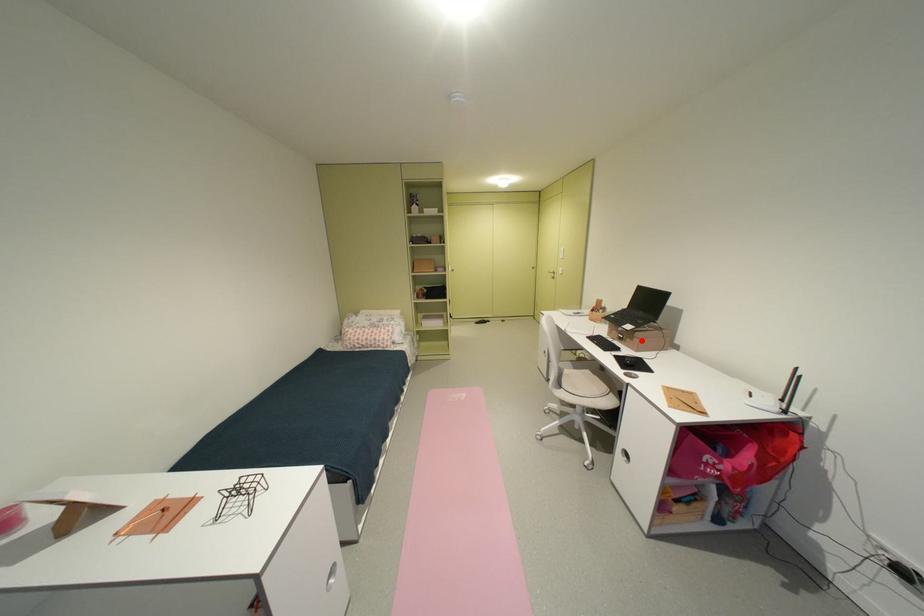
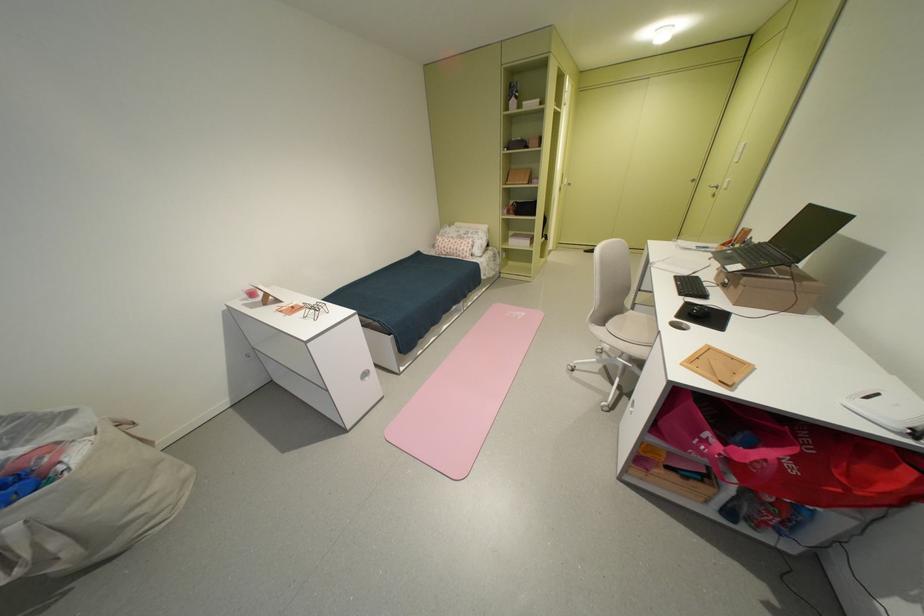
The point at the highlighted location is marked in the first image. Where is the corresponding point in the second image?

(746, 288)